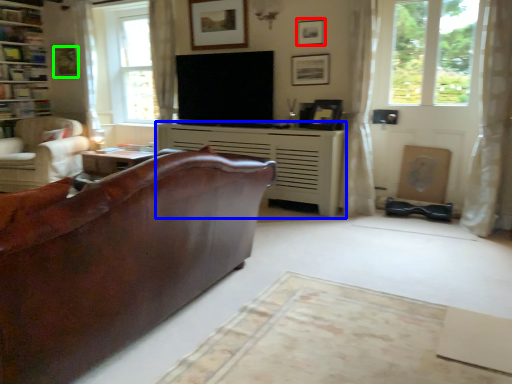
Question: Which object is the closest to the picture frame (highlighted by a red box)? Choose among these: fireplace (highlighted by a blue box) or picture frame (highlighted by a green box).

Choices:
 (A) fireplace
 (B) picture frame

Answer: (A)